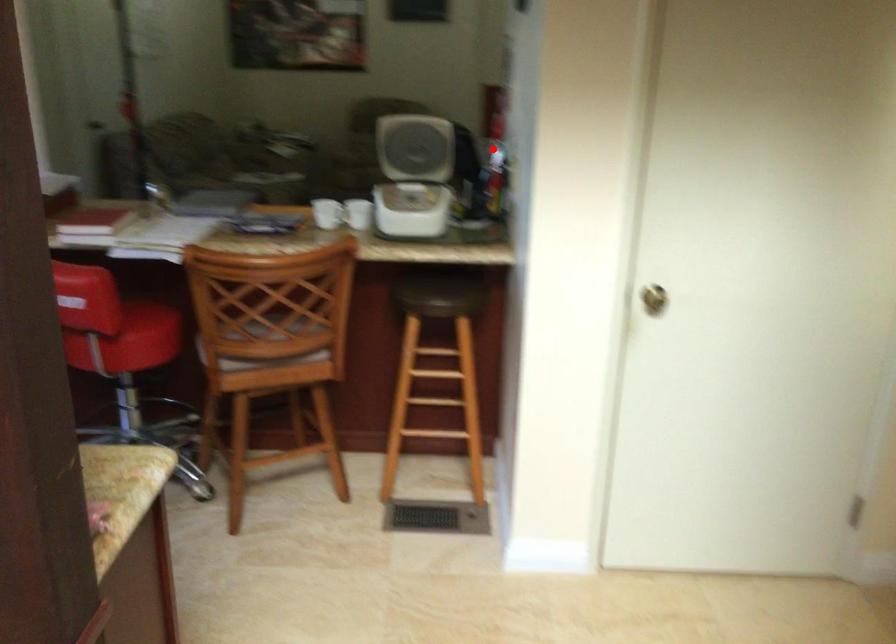
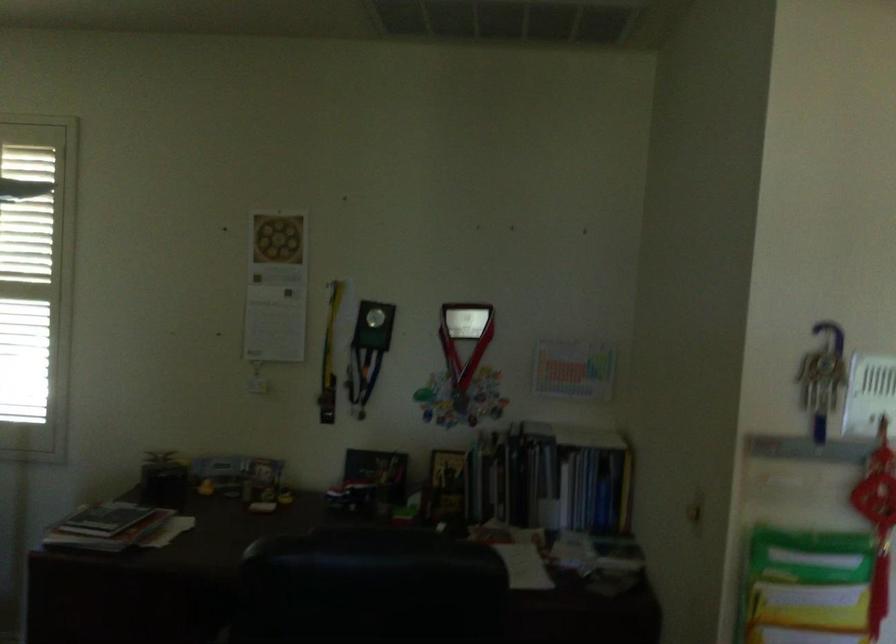
Locate, in the second image, the point that corresponds to the highlighted location in the first image.

(814, 558)